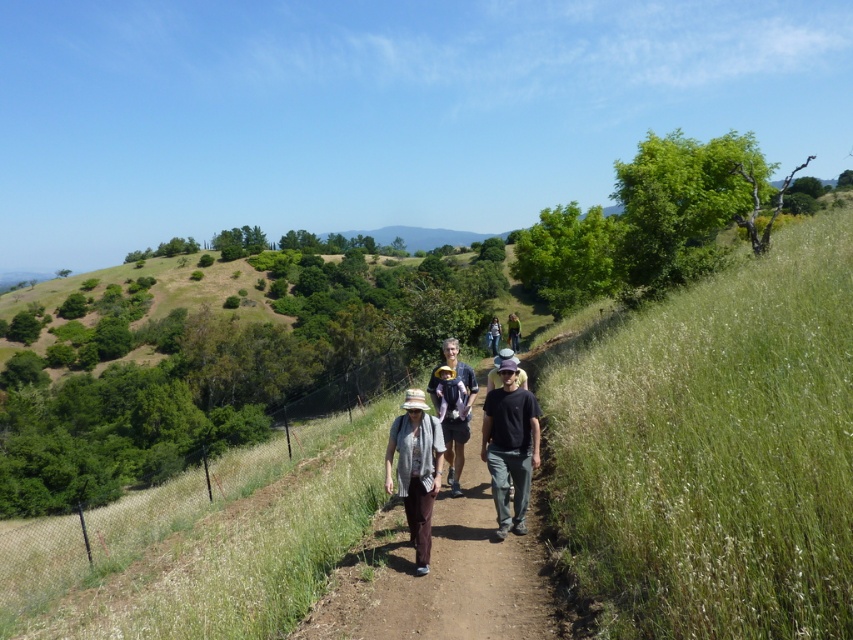
Question: Which point is closer to the camera?

Choices:
 (A) (515, 349)
 (B) (440, 541)

Answer: (B)

Question: Can you confirm if green grassy hillside at right is smaller than brown dirt path at center?

Choices:
 (A) no
 (B) yes

Answer: (B)

Question: Considering the relative positions of black cotton shirt at center and brown woven hat at center in the image provided, where is black cotton shirt at center located with respect to brown woven hat at center?

Choices:
 (A) left
 (B) right

Answer: (B)

Question: Is denim jacket at center positioned behind light brown leather jacket at center?

Choices:
 (A) yes
 (B) no

Answer: (A)

Question: Which is nearer to the denim jacket at center?

Choices:
 (A) light brown leather jacket at center
 (B) brown dirt path at center

Answer: (A)

Question: Which object is the farthest from the black cotton shirt at center?

Choices:
 (A) light brown leather jacket at center
 (B) green grassy hillside at right
 (C) brown woven hat at center
 (D) denim jacket at center

Answer: (D)